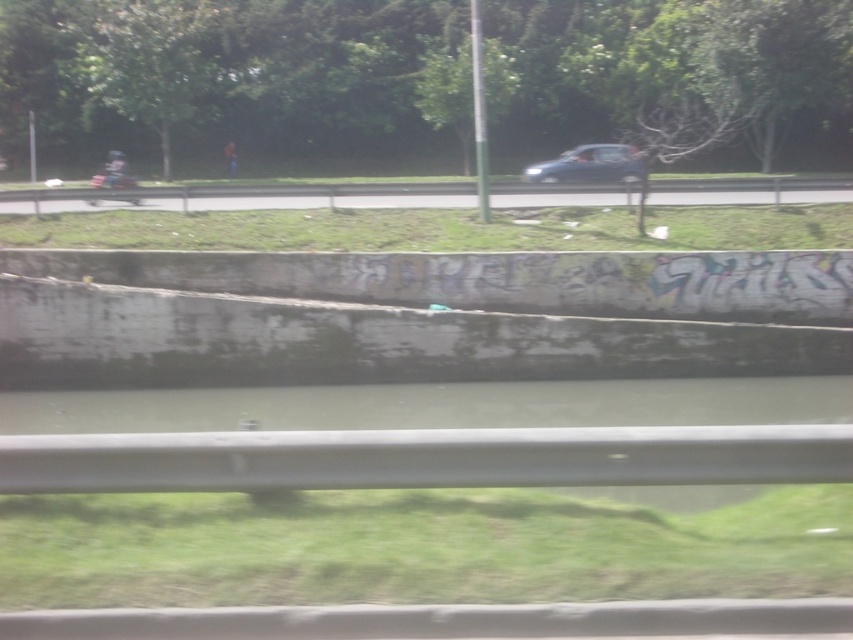
The width and height of the screenshot is (853, 640). Describe the element at coordinates (439, 436) in the screenshot. I see `gray metallic river at center` at that location.

Does point (62, 465) come closer to viewer compared to point (625, 161)?

Yes, point (62, 465) is closer to viewer.

This screenshot has height=640, width=853. Identify the location of gray metallic river at center. (439, 436).